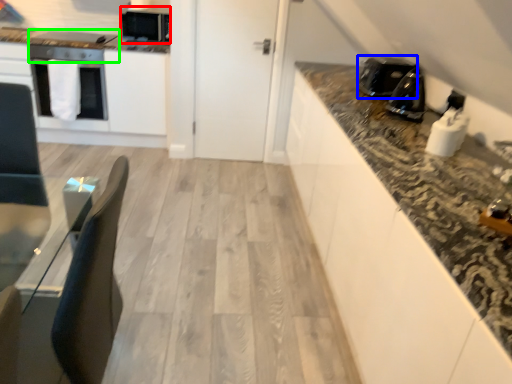
Question: Considering the real-world distances, which object is closest to appliance (highlighted by a red box)? kitchen appliance (highlighted by a blue box) or appliance (highlighted by a green box).

Choices:
 (A) kitchen appliance
 (B) appliance

Answer: (B)